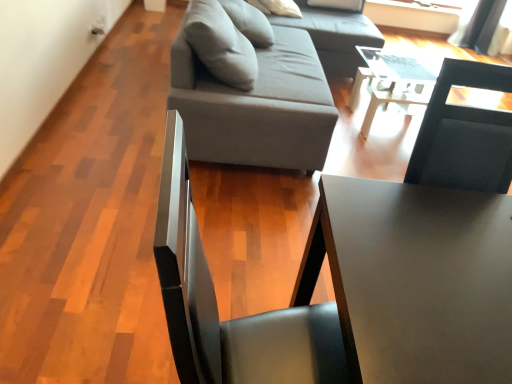
Question: Which is correct: gray fabric studio couch at upper center is inside white glossy table at center, which is the first table in top-to-bottom order, or outside of it?

Choices:
 (A) outside
 (B) inside

Answer: (A)

Question: From a real-world perspective, is gray fabric studio couch at upper center physically located above or below white glossy table at center, which is the 2th table from front to back?

Choices:
 (A) below
 (B) above

Answer: (B)

Question: Which of these objects is positioned farthest from the white glossy table at center, which is the first table in top-to-bottom order?

Choices:
 (A) gray fabric couch at upper center
 (B) gray fabric studio couch at upper center
 (C) matte black table at center, acting as the second table starting from the back

Answer: (C)

Question: Estimate the real-world distances between objects in this image. Which object is farther from the white glossy table at center, arranged as the first table when viewed from the back?

Choices:
 (A) gray fabric couch at upper center
 (B) matte black table at center, which is the 1th table from bottom to top
 (C) gray fabric studio couch at upper center

Answer: (B)